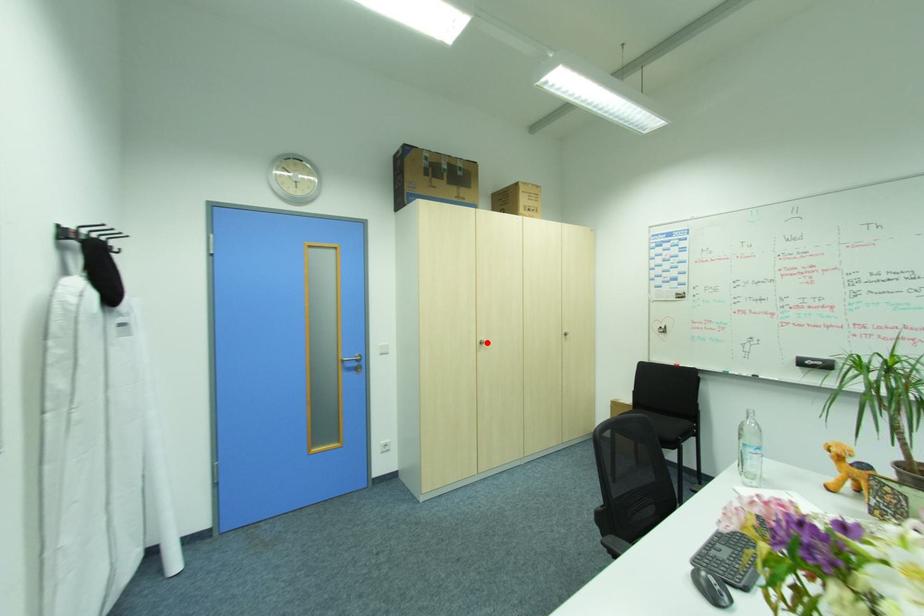
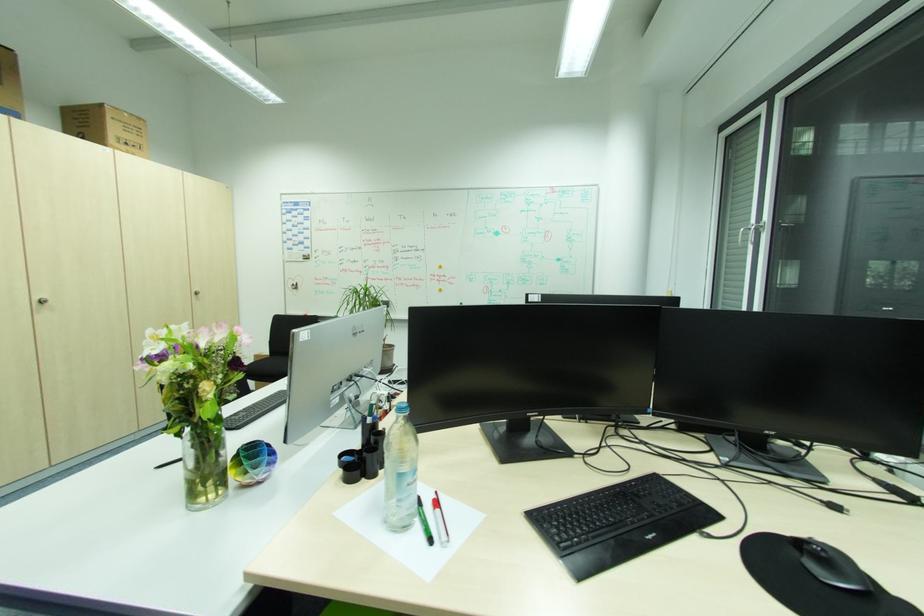
The point at the highlighted location is marked in the first image. Where is the corresponding point in the second image?

(47, 302)